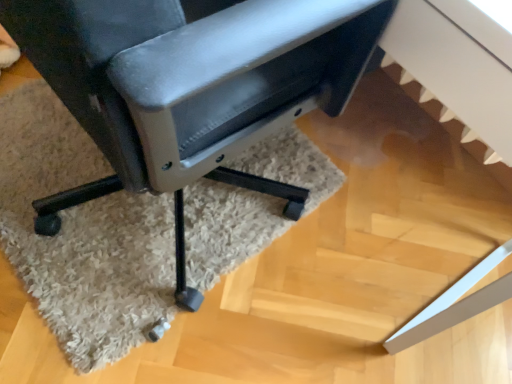
Identify the location of empty space that is to the right of beige shaggy rug at lower center. The image size is (512, 384). tap(374, 233).